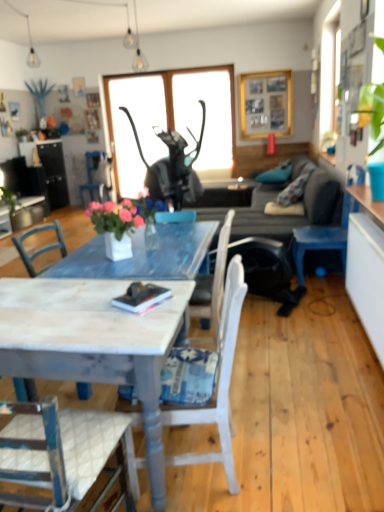
I want to click on free space in front of hardcover book at center, so click(137, 323).